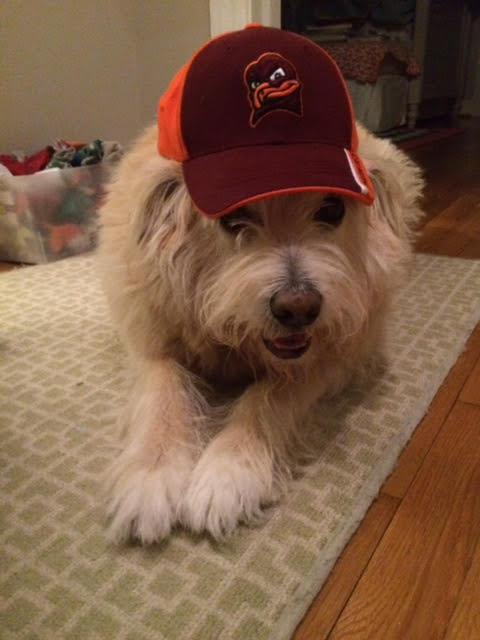
Identify the location of rug. The height and width of the screenshot is (640, 480). (163, 592).